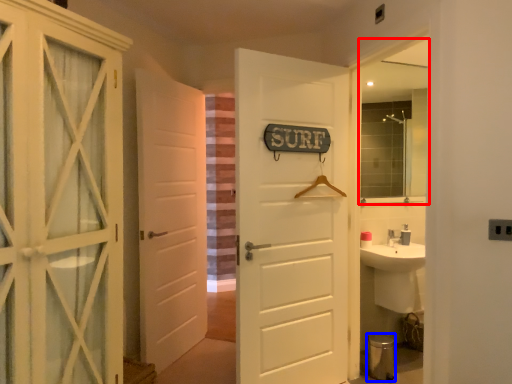
Question: Among these objects, which one is nearest to the camera, mirror (highlighted by a red box) or toilet bowl (highlighted by a blue box)?

Choices:
 (A) mirror
 (B) toilet bowl

Answer: (B)